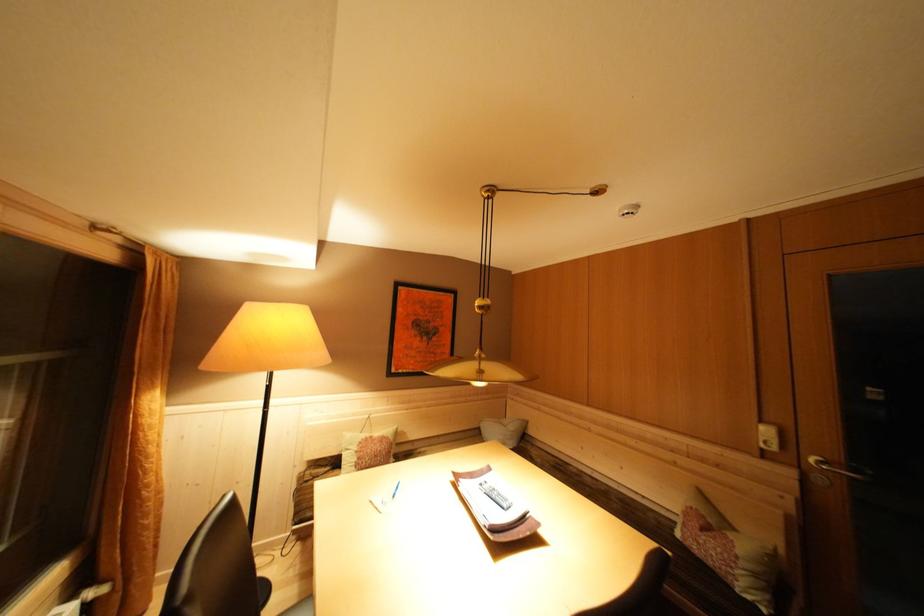
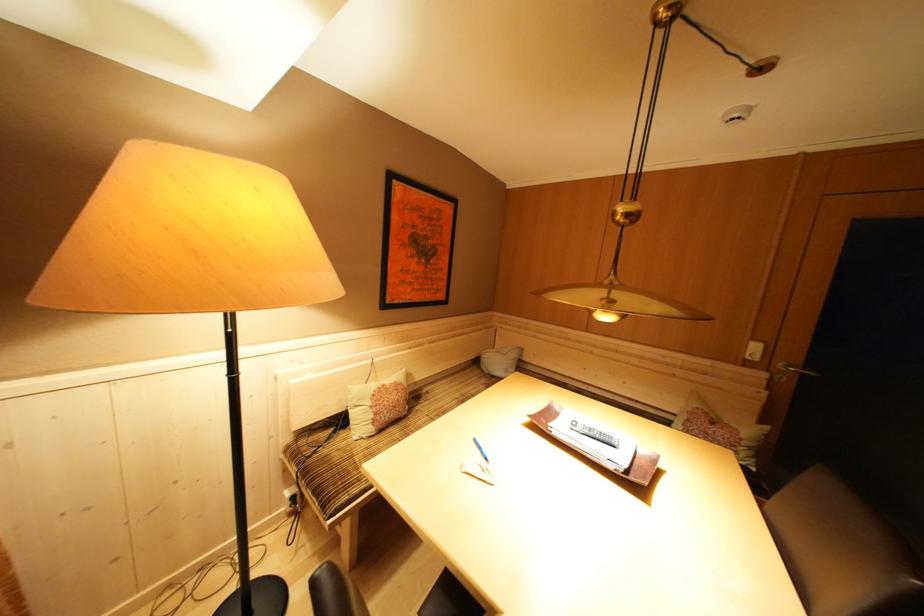
How did the camera likely rotate?

The camera's rotation is toward right-down.